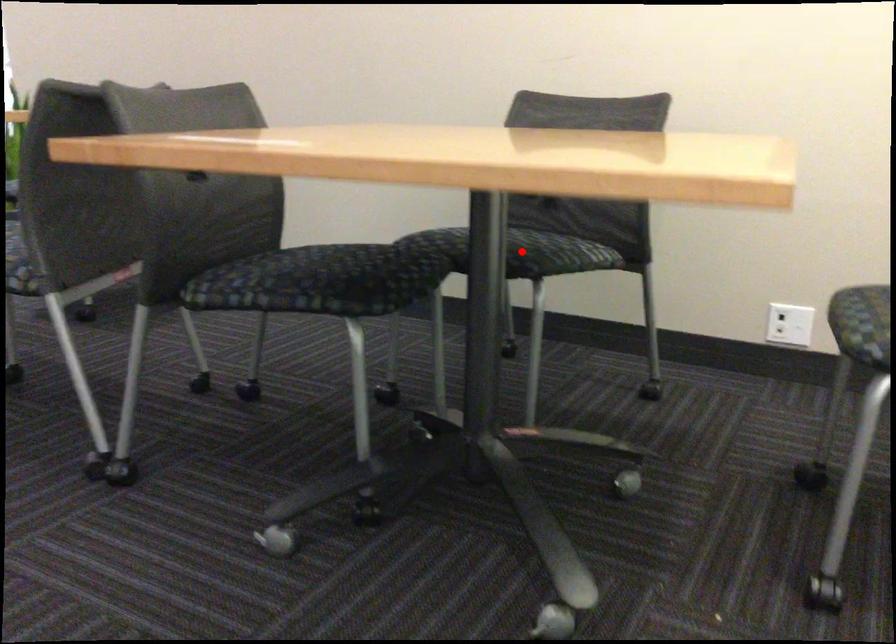
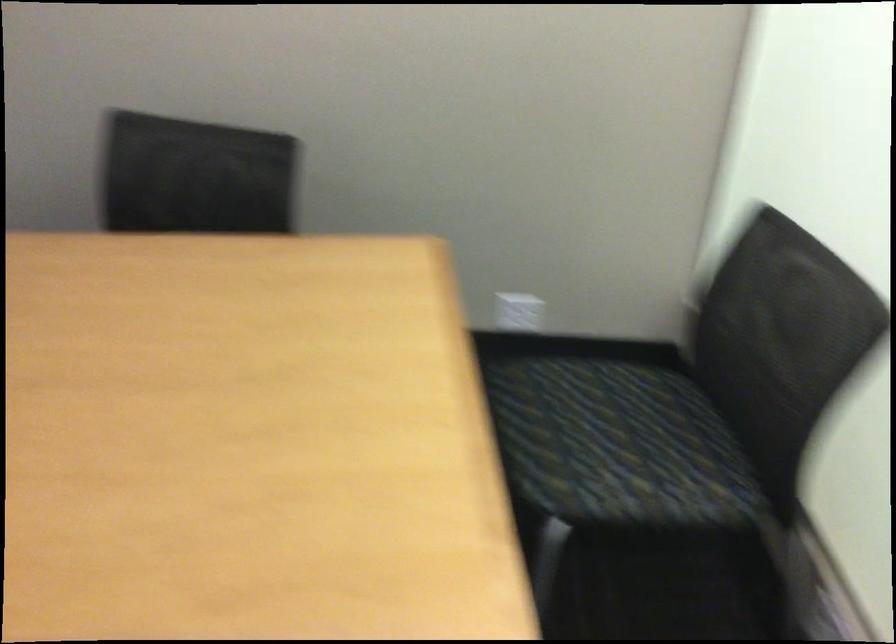
Question: I am providing you with two images of the same scene from different viewpoints. A red point is marked on the first image. Can you still see the location of the red point in image 2?

Choices:
 (A) Yes
 (B) No

Answer: (B)